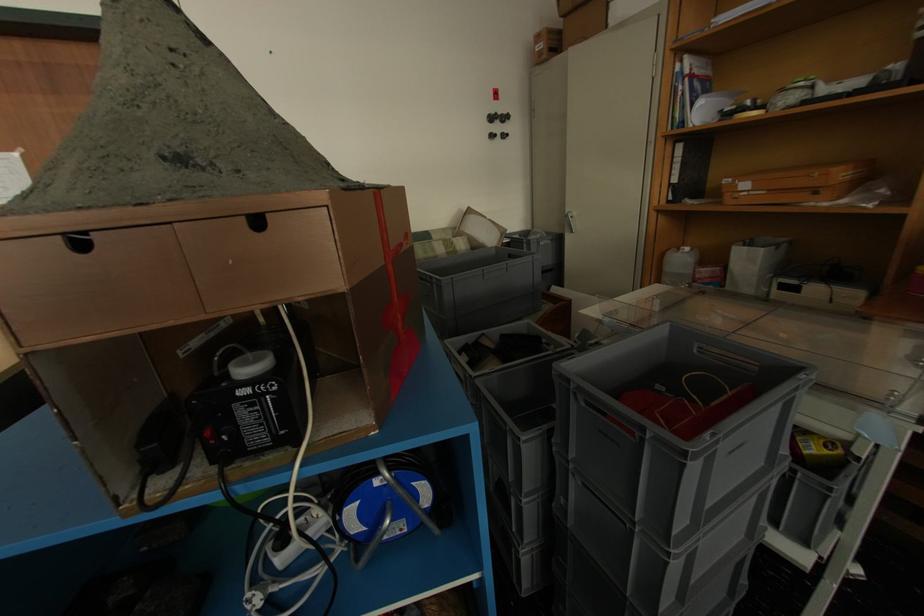
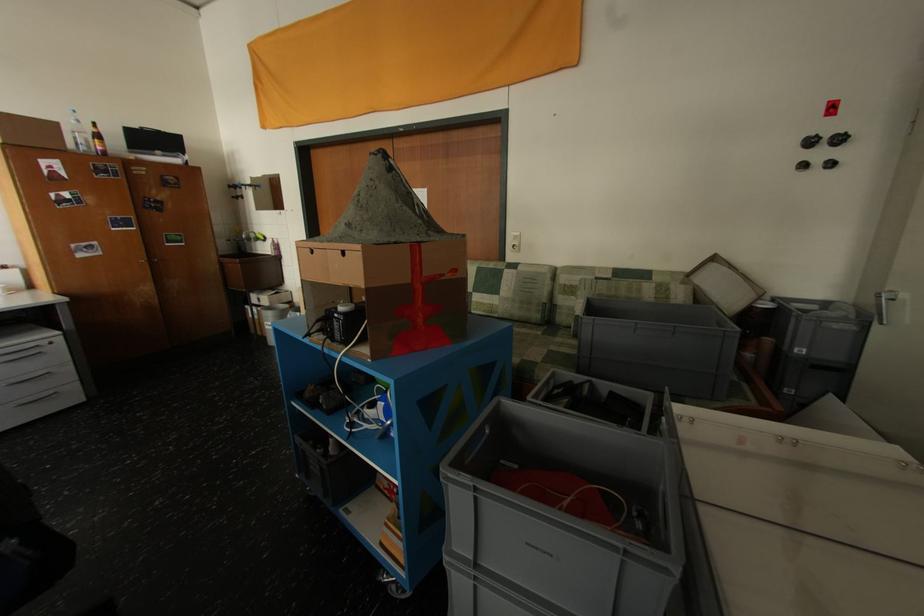
Where in the second image is the point corresponding to pixel 502 114 from the first image?

(821, 137)